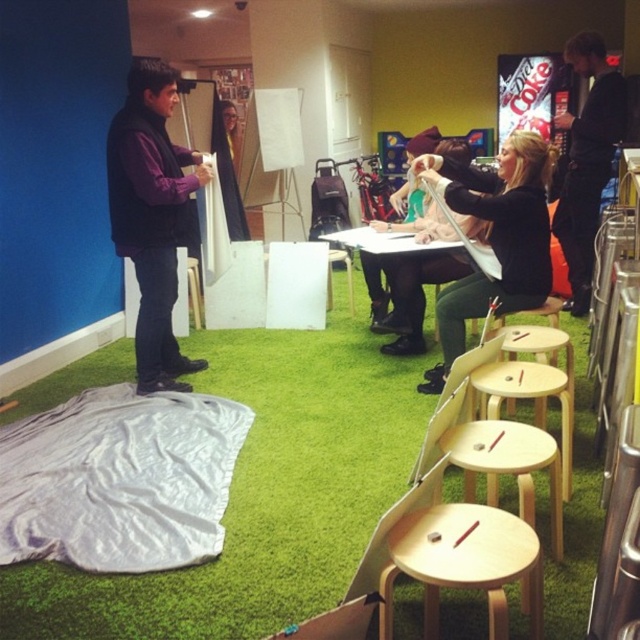
Question: Among these objects, which one is farthest from the camera?

Choices:
 (A) green artificial turf at center
 (B) wooden stool at center
 (C) light wood stool at lower center
 (D) purple fleece vest at center

Answer: (B)

Question: Which object appears closest to the camera in this image?

Choices:
 (A) light wood stool at lower center
 (B) green artificial turf at center

Answer: (A)

Question: Is purple fleece vest at center positioned before black matte shirt at center?

Choices:
 (A) yes
 (B) no

Answer: (B)

Question: Does light wood stool at lower center come in front of black fabric at upper right?

Choices:
 (A) no
 (B) yes

Answer: (B)

Question: Can you confirm if black matte shirt at center is thinner than wooden stool at center?

Choices:
 (A) no
 (B) yes

Answer: (A)

Question: Which point is farther to the camera?

Choices:
 (A) (440, 547)
 (B) (154, 360)

Answer: (B)